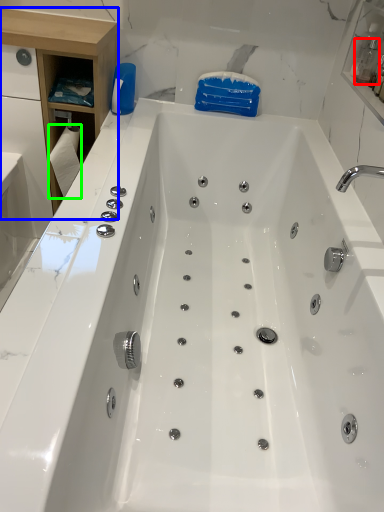
Question: Which is nearer to the bottle (highlighted by a red box)? cabinetry (highlighted by a blue box) or toilet paper (highlighted by a green box).

Choices:
 (A) cabinetry
 (B) toilet paper

Answer: (A)